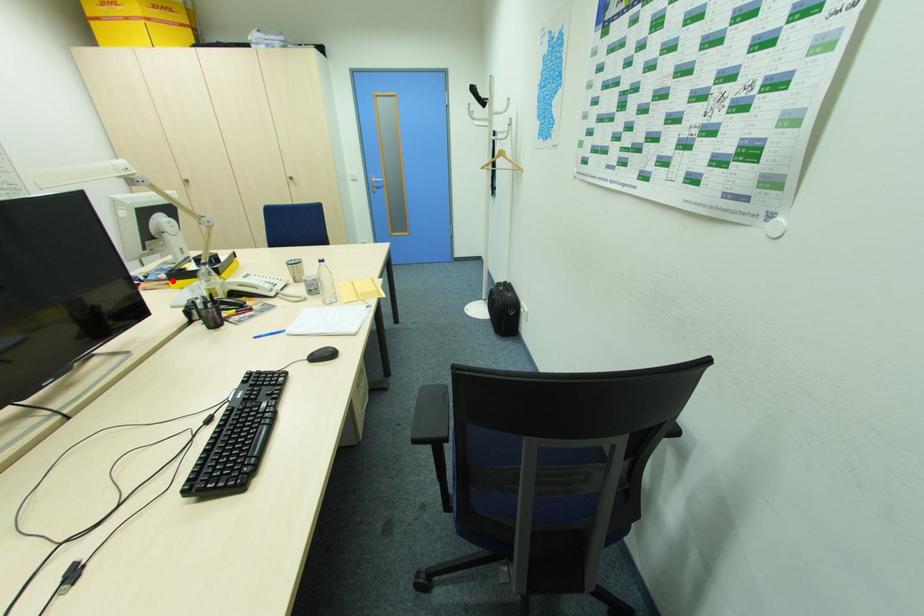
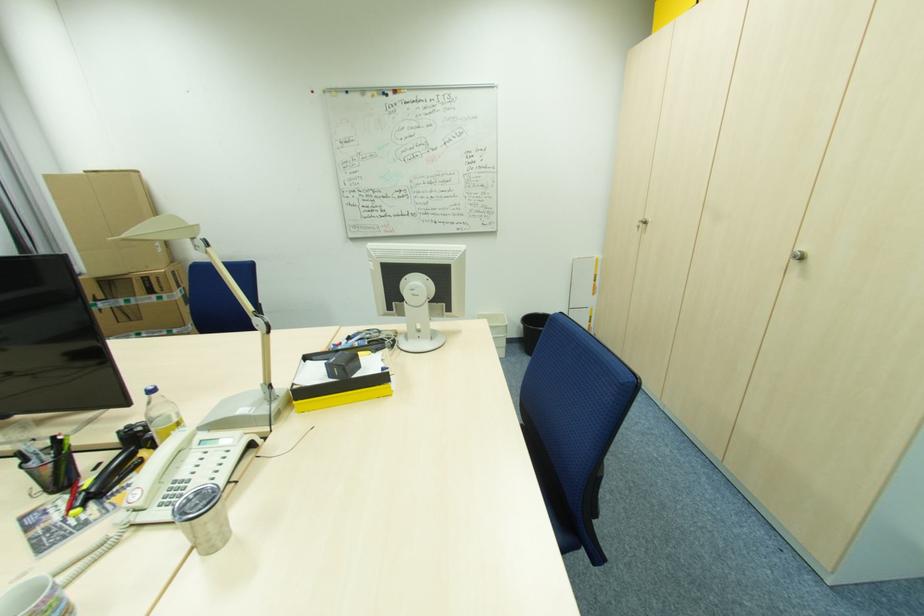
Question: I am providing you with two images of the same scene from different viewpoints. A red point is marked on the first image. At the location where the point appears in image 1, is it still visible in image 2?

Choices:
 (A) Yes
 (B) No

Answer: (B)